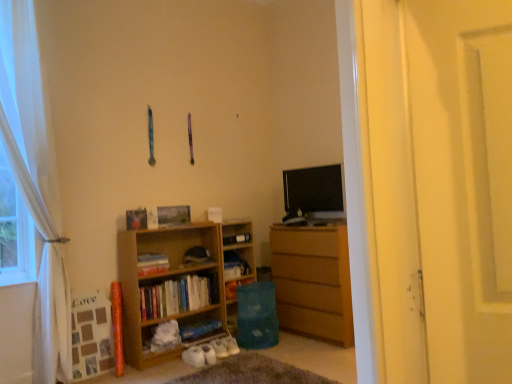
Question: Is wooden chest of drawers at right in front of or behind wooden bookshelf at center, the 3th book positioned from the top, in the image?

Choices:
 (A) behind
 (B) front

Answer: (A)

Question: From a real-world perspective, relative to wooden bookshelf at center, the 3th book positioned from the top, is wooden chest of drawers at right vertically above or below?

Choices:
 (A) below
 (B) above

Answer: (A)

Question: Estimate the real-world distances between objects in this image. Which object is closer to the wooden chest of drawers at right?

Choices:
 (A) hardcover book at center, the 2th book in the top-to-bottom sequence
 (B) white sheer curtain at left
 (C) matte black tv at upper right
 (D) white fluffy slippers at lower center
 (E) blue matte book at lower center, arranged as the fourth book when viewed from the top

Answer: (C)

Question: Considering the real-world distances, which object is farthest from the white matte screen door at right?

Choices:
 (A) wooden chest of drawers at right
 (B) wooden bookshelf at center, the 3th book positioned from the top
 (C) hardcover book at center, the fourth book in the bottom-to-top sequence
 (D) hardcover book at center, the 2th book in the top-to-bottom sequence
 (E) blue matte book at lower center, arranged as the fourth book when viewed from the top

Answer: (C)